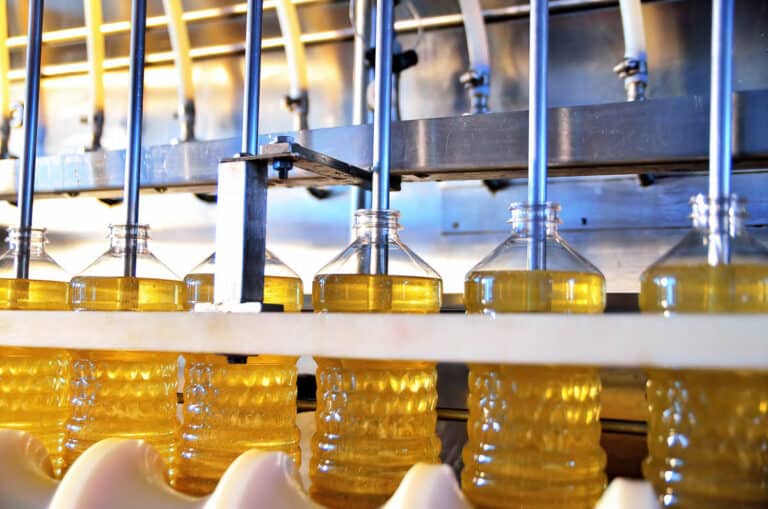
Where is `metal wall`? This screenshot has height=509, width=768. metal wall is located at coordinates (415, 214).